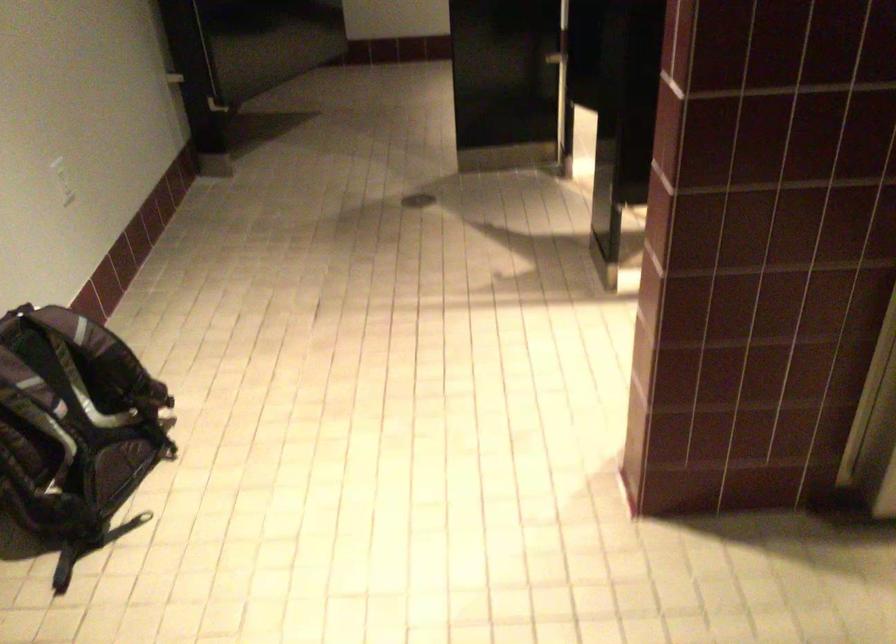
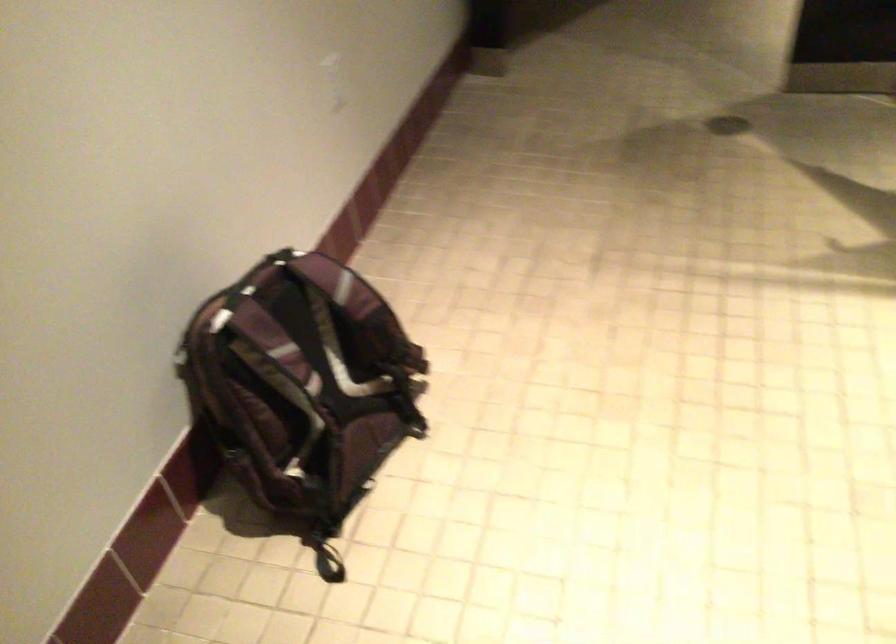
In the second image, find the point that corresponds to [91,567] in the first image.

(328, 567)